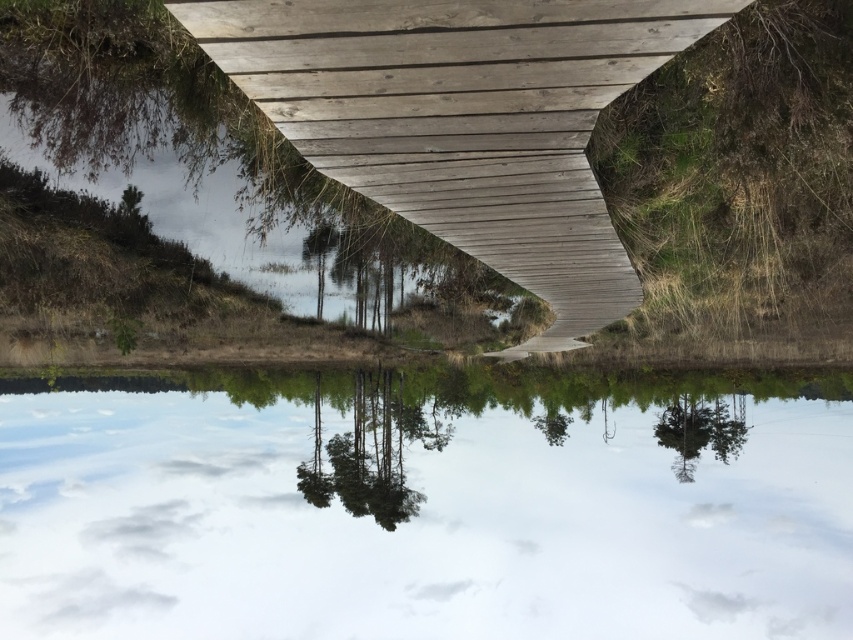
Question: From the image, what is the correct spatial relationship of transparent glass river at center in relation to green matte trees at center?

Choices:
 (A) below
 (B) above

Answer: (A)

Question: Is transparent glass river at center above green matte tree at lower right?

Choices:
 (A) yes
 (B) no

Answer: (B)

Question: In this image, where is natural wood foot bridge at center located relative to green matte trees at center?

Choices:
 (A) below
 (B) above

Answer: (B)

Question: Which point appears farthest from the camera in this image?

Choices:
 (A) (718, 412)
 (B) (624, 252)
 (C) (653, 628)

Answer: (C)

Question: Estimate the real-world distances between objects in this image. Which object is closer to the transparent glass river at center?

Choices:
 (A) green matte trees at center
 (B) green matte tree at lower right
 (C) natural wood foot bridge at center

Answer: (A)

Question: Which object is closer to the camera taking this photo?

Choices:
 (A) green matte tree at lower right
 (B) natural wood foot bridge at center

Answer: (B)